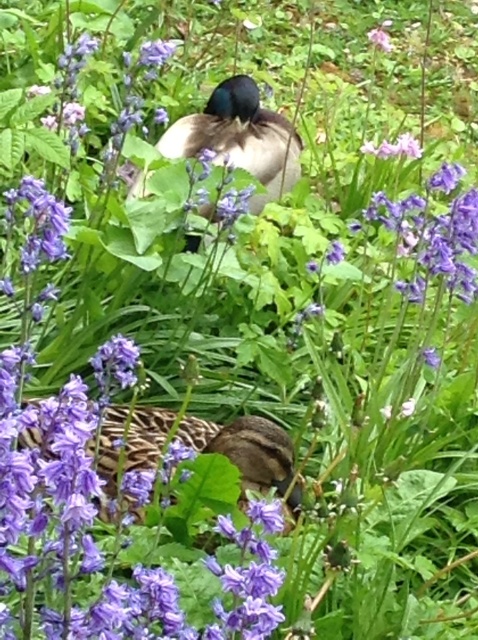
Does point (181, 124) lie behind point (378, 33)?

No, it is not.

Does shiny black duck at center have a lesser height compared to pink matte flower at upper center?

Incorrect, shiny black duck at center's height does not fall short of pink matte flower at upper center's.

Locate an element on the screen. The height and width of the screenshot is (640, 478). shiny black duck at center is located at coordinates (239, 138).

This screenshot has width=478, height=640. I want to click on shiny black duck at center, so click(x=239, y=138).